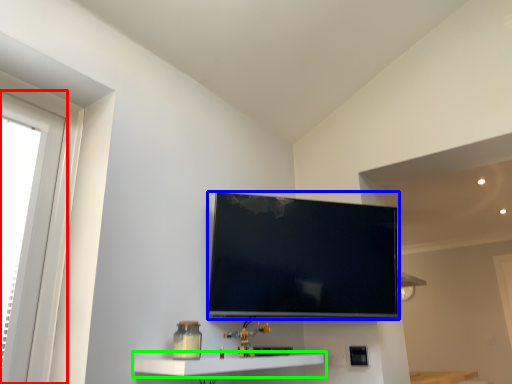
Question: Considering the real-world distances, which object is farthest from window (highlighted by a red box)? television (highlighted by a blue box) or shelf (highlighted by a green box)?

Choices:
 (A) television
 (B) shelf

Answer: (A)